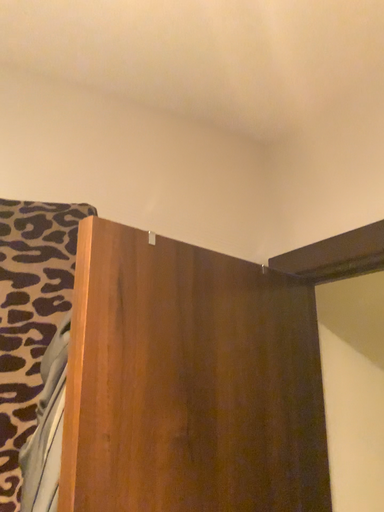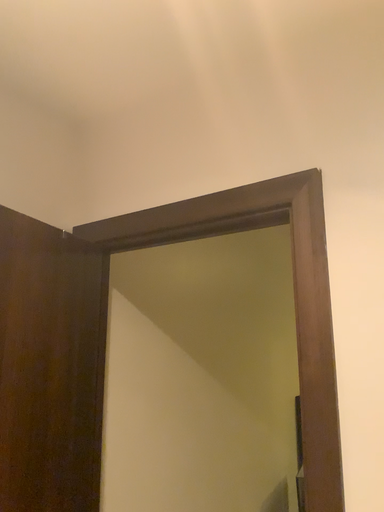
Question: How did the camera likely rotate when shooting the video?

Choices:
 (A) rotated right
 (B) rotated left

Answer: (A)